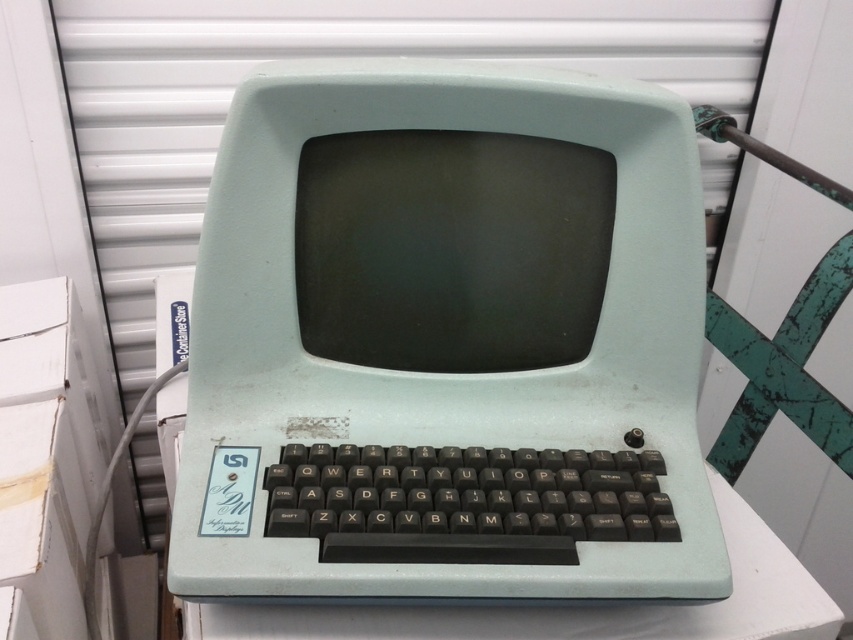
You are a technician who needs to connect a cable between the matte plastic computer at center and the white plastic keyboard at center. The cable you have is 15 centimeters long. Will the cable be long enough to connect them?

The distance between the matte plastic computer at center and the white plastic keyboard at center is 17.26 centimeters, so the 15 centimeter cable will not be long enough to connect them.

You are standing in front of the computer terminal. You need to place a small USB drive between the matte plastic computer at center and the white plastic keyboard at center. Which object should you move to access the space between them?

You should move the matte plastic computer at center because it is in front of the white plastic keyboard at center, so moving it would allow access to the space behind it where the USB drive can be placed.